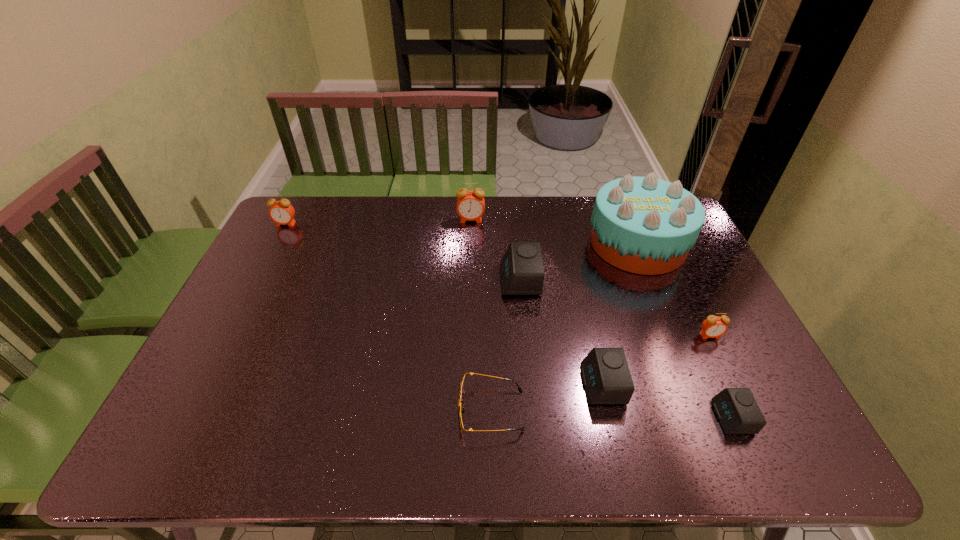
Locate an element on the screen. The width and height of the screenshot is (960, 540). free point that satisfies the following two spatial constraints: 1. on the face of the rightmost pink alarm clock; 2. on the front-facing side of the second black alarm clock from right to left is located at coordinates (733, 384).